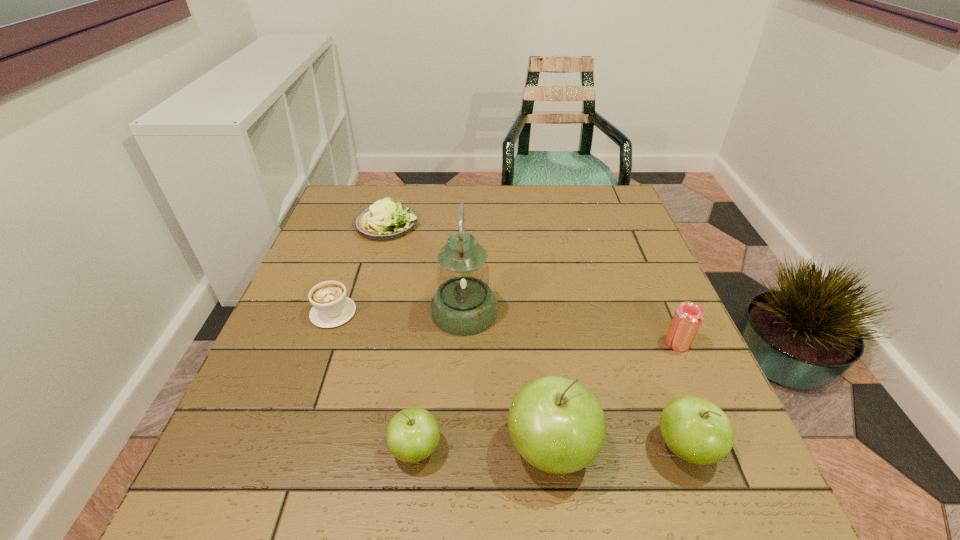
This screenshot has height=540, width=960. Find the location of `the shortest apple`. the shortest apple is located at coordinates (412, 435).

Where is `the tallest apple`? the tallest apple is located at coordinates (556, 424).

Find the location of a particular element. the second tallest object is located at coordinates (556, 424).

Identify the location of the rightmost apple. (696, 430).

At what (x,y) coordinates should I click in order to perform the action: click on the fifth shortest object. Please return your answer as a coordinate pair (x, y). The image size is (960, 540). Looking at the image, I should click on (696, 430).

You are a GUI agent. You are given a task and a screenshot of the screen. Output one action in this format:
    pyautogui.click(x=<x>, y=<y>)
    Task: Click on the lettuce
    Image resolution: width=960 pixels, height=540 pixels.
    Given the screenshot: What is the action you would take?
    pyautogui.click(x=384, y=220)

At what (x,y) coordinates should I click in order to perform the action: click on cappuccino. Please return your answer as a coordinate pair (x, y). Looking at the image, I should click on (331, 308).

At what (x,y) coordinates should I click in order to perform the action: click on the tallest object. Please return your answer as a coordinate pair (x, y). This screenshot has height=540, width=960. Looking at the image, I should click on (463, 305).

Locate an element on the screen. The image size is (960, 540). beer can is located at coordinates (687, 319).

Locate an element on the screen. vacant position located on the back of the leftmost apple is located at coordinates (x=425, y=363).